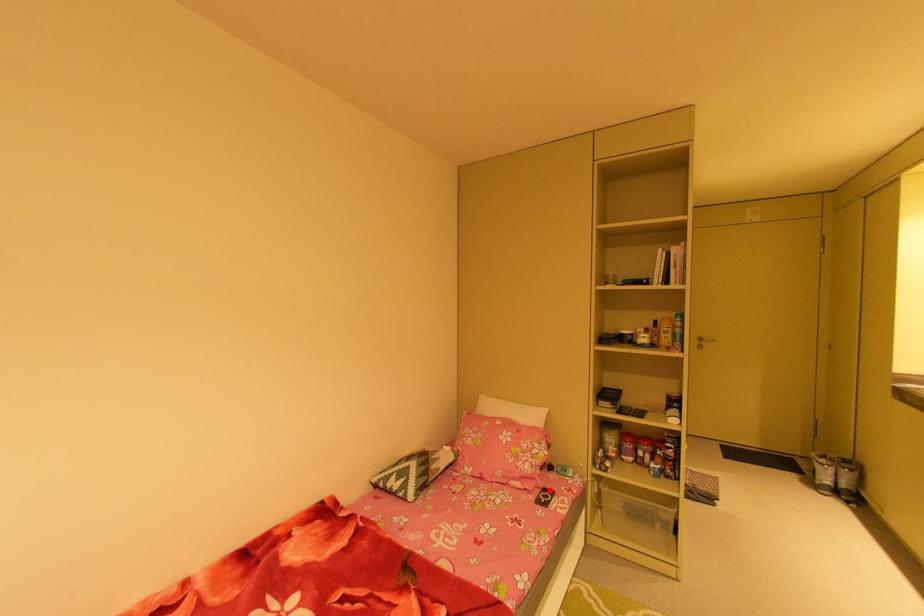
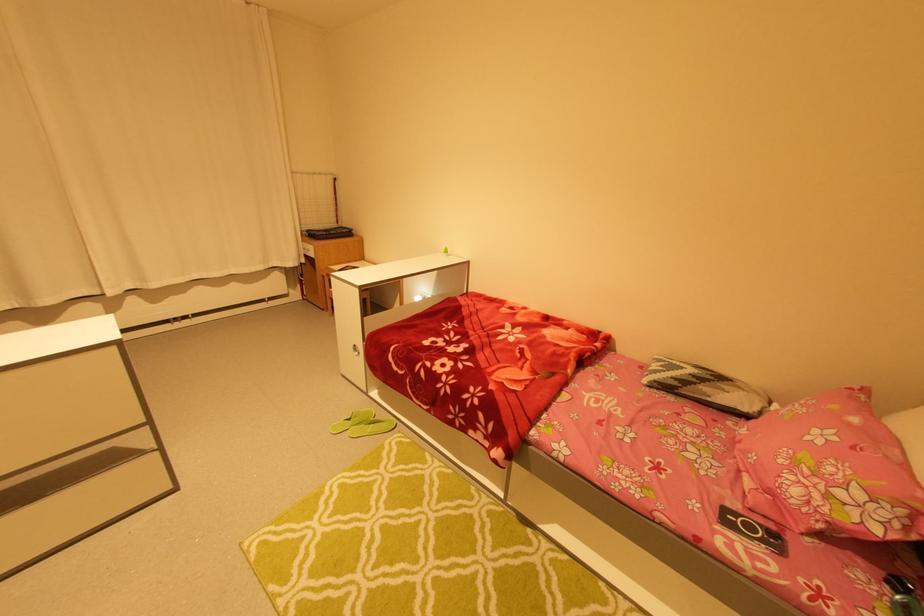
The point at the highlighted location is marked in the first image. Where is the corresponding point in the second image?

(781, 536)